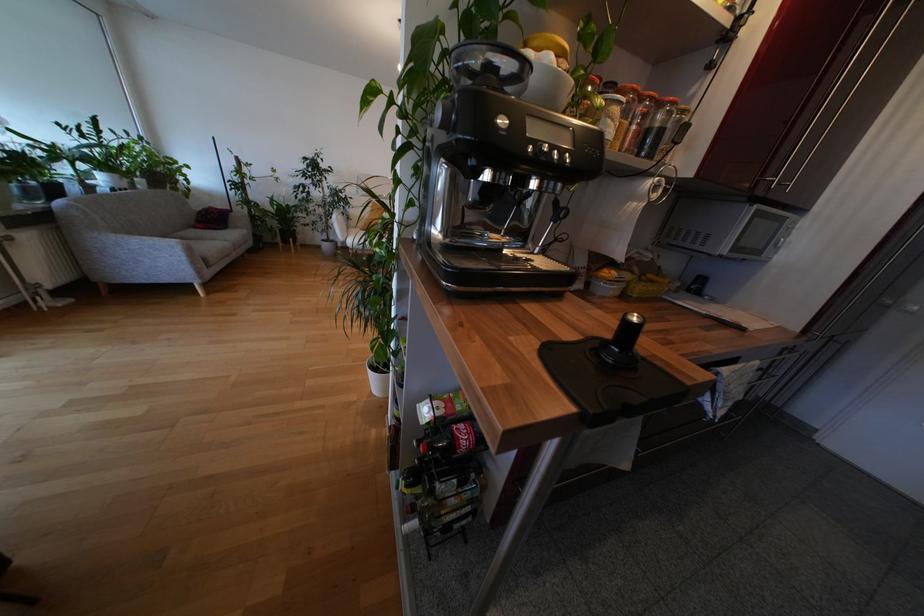
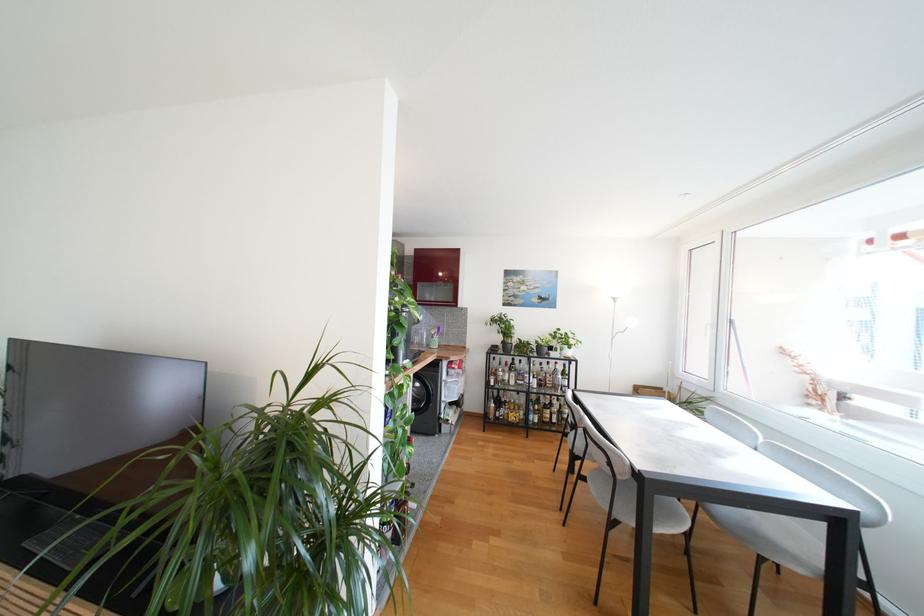
Question: I am providing you with two images of the same scene from different viewpoints. Which of the following objects are not visible in image2?

Choices:
 (A) glass bottle
 (B) grey chair sitting surface
 (C) textured glass vase
 (D) orange jar lid

Answer: (D)